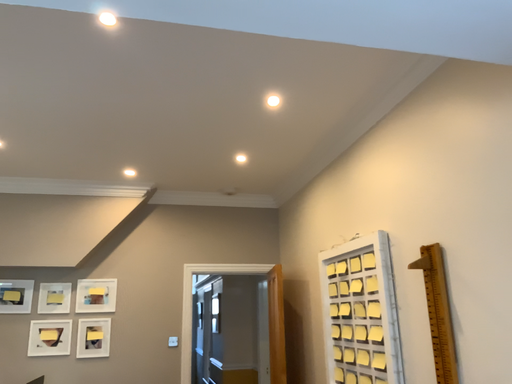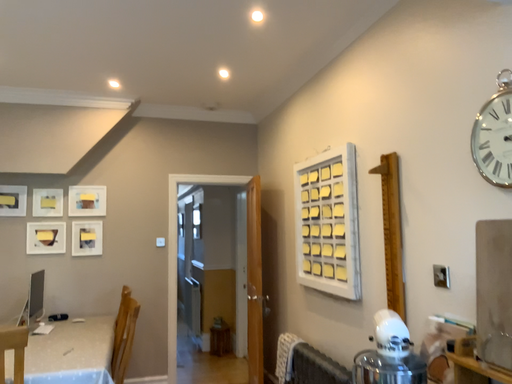
Question: Which way did the camera rotate in the video?

Choices:
 (A) rotated downward
 (B) rotated upward

Answer: (A)